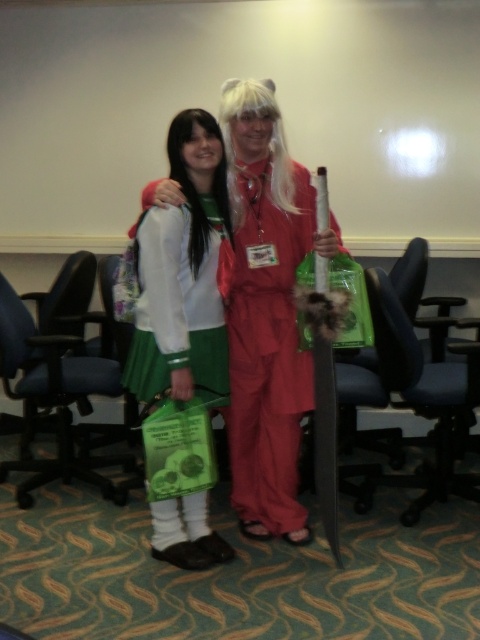
Consider the image. You are standing in the center of the room and want to move towards the matte red jumpsuit at center. Which direction should you go?

The matte red jumpsuit at center is already at your current position, so you don not need to move in any direction.

Looking at this image, you are a photographer at the event and need to capture a closeup shot of both the green fabric skirt at center and the white silky wig at center in the same frame. Given that your camera has a minimum focus distance of 10 inches, will you be able to adjust the camera to include both objects without moving closer?

The green fabric skirt at center and the white silky wig at center are 9.94 inches apart, which is less than the camera minimum focus distance of 10 inches. Therefore, the photographer can adjust the camera to include both objects without moving closer.

You are at a convention and need to take a photo with both the matte red jumpsuit at center and the green fabric skirt at center. Which one should you focus on first to ensure both are in frame?

You should focus on the matte red jumpsuit at center first because it is positioned under the green fabric skirt at center, so adjusting the frame to include the lower one ensures the upper one is also captured.